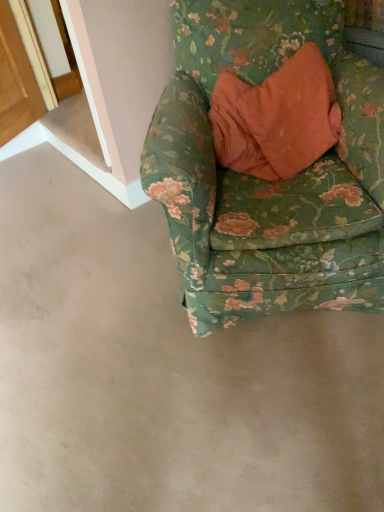
Question: From a real-world perspective, is gray concrete at lower center positioned above or below floral fabric chair at upper right?

Choices:
 (A) above
 (B) below

Answer: (B)

Question: Relative to floral fabric chair at upper right, is gray concrete at lower center in front or behind?

Choices:
 (A) behind
 (B) front

Answer: (B)

Question: Is gray concrete at lower center situated inside floral fabric chair at upper right or outside?

Choices:
 (A) outside
 (B) inside

Answer: (A)

Question: Is floral fabric chair at upper right inside or outside of gray concrete at lower center?

Choices:
 (A) outside
 (B) inside

Answer: (A)

Question: From their relative heights in the image, would you say floral fabric chair at upper right is taller or shorter than gray concrete at lower center?

Choices:
 (A) tall
 (B) short

Answer: (A)

Question: Is point (215, 81) closer or farther from the camera than point (21, 415)?

Choices:
 (A) farther
 (B) closer

Answer: (A)

Question: From a real-world perspective, is floral fabric chair at upper right above or below gray concrete at lower center?

Choices:
 (A) above
 (B) below

Answer: (A)